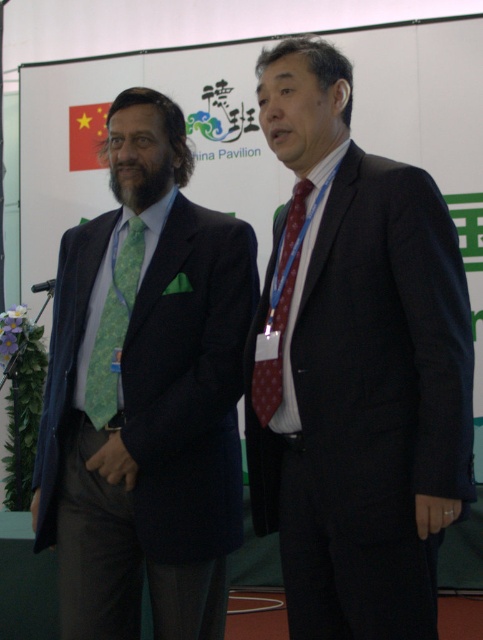
Question: Can you confirm if dark blue suit at center is positioned below maroon dotted tie at center?

Choices:
 (A) no
 (B) yes

Answer: (B)

Question: Does dark blue suit at center appear under maroon dotted tie at center?

Choices:
 (A) yes
 (B) no

Answer: (A)

Question: Which point is farther to the camera?

Choices:
 (A) green textured tie at left
 (B) maroon dotted tie at center
 (C) dark blue suit at center
 (D) green patterned tie at left

Answer: (D)

Question: Which object is farther from the camera taking this photo?

Choices:
 (A) maroon dotted tie at center
 (B) green patterned tie at left
 (C) dark blue suit at center

Answer: (B)

Question: Which point is closer to the camera?

Choices:
 (A) (204, 212)
 (B) (124, 282)
 (C) (303, 614)
 (D) (255, 353)

Answer: (C)

Question: Can you confirm if dark blue suit at center is bigger than green patterned tie at left?

Choices:
 (A) no
 (B) yes

Answer: (B)